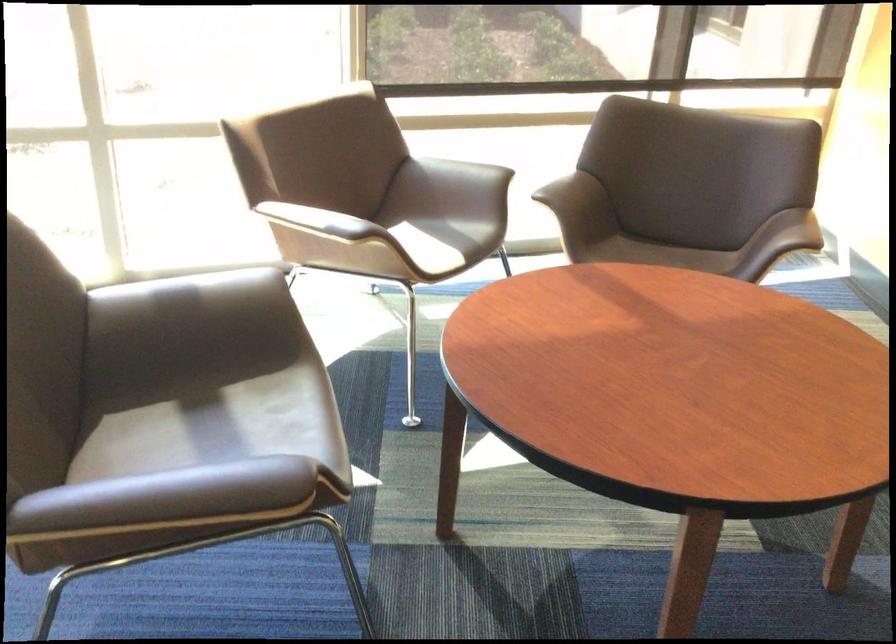
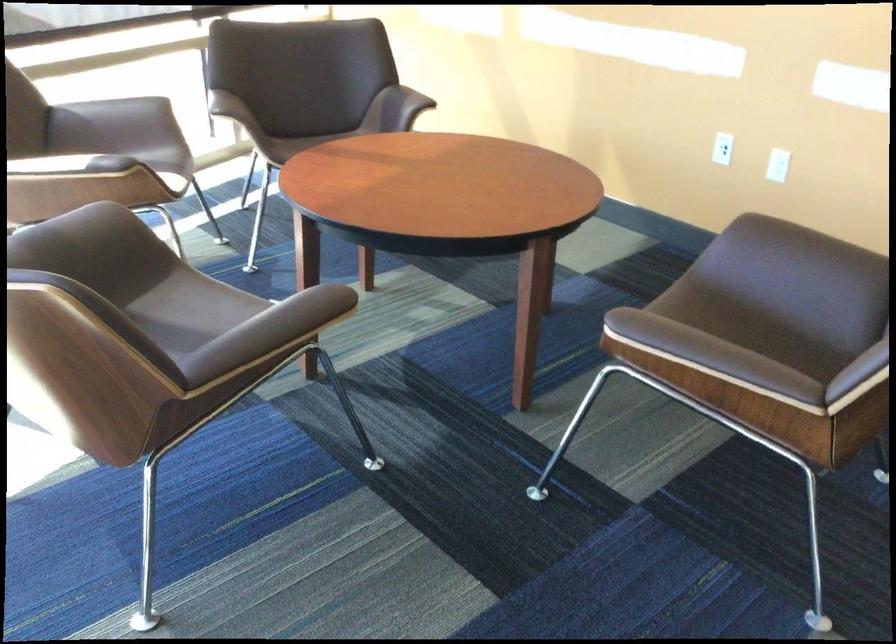
Question: I am providing you with two images of the same scene from different viewpoints. Please identify which objects are invisible in image2.

Choices:
 (A) chair armrest
 (B) turquoise pot handle
 (C) chair sitting surface
 (D) white wall outlet

Answer: (A)